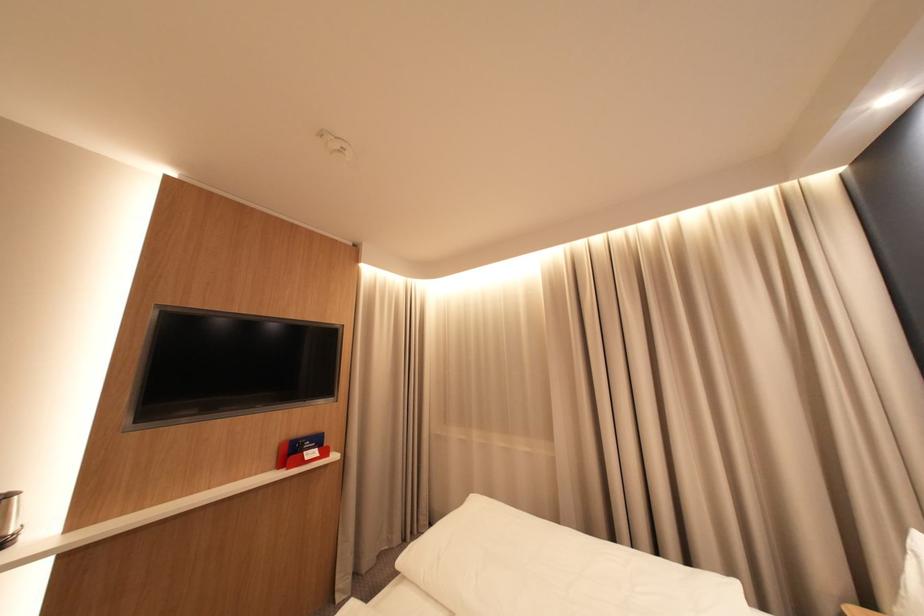
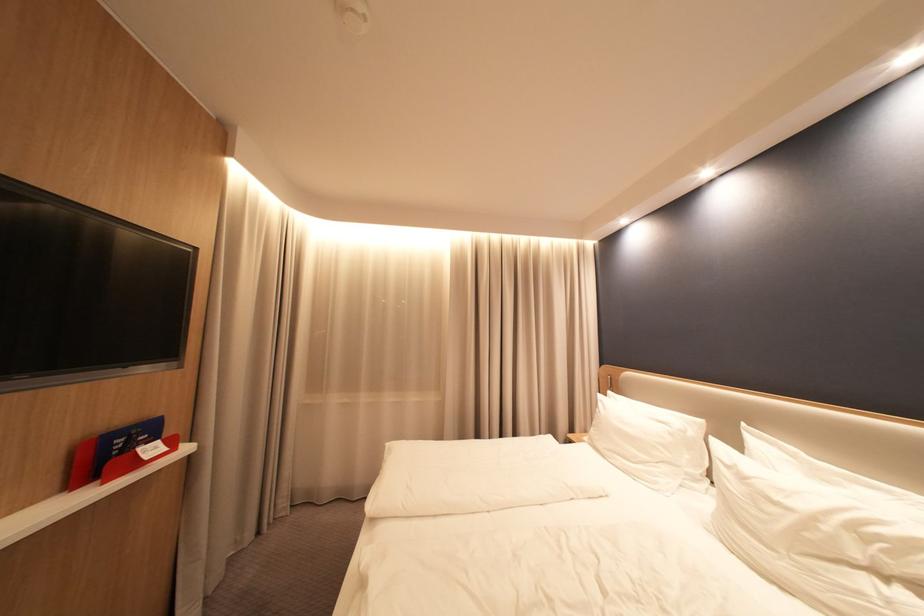
Where in the second image is the point corresponding to the point at 314,455 from the first image?

(150, 452)